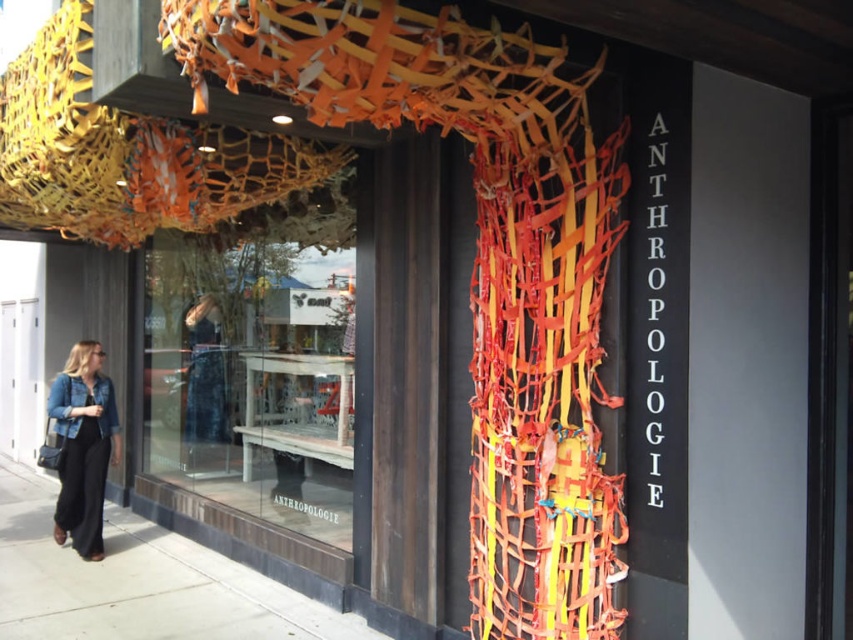
You are standing in front of the Anthropologie store and want to take a photo of the transparent glass display at center. Where should you position yourself to capture it in the frame?

The transparent glass display at center is located at point (257, 358), so you should position yourself directly in front of it to capture it in the frame.

You are a customer standing outside the Anthropologie store looking at the storefront. You see a transparent glass display at center and a denim jacket at lower left. Which object is closer to the left side of the storefront?

The denim jacket at lower left is closer to the left side of the storefront.